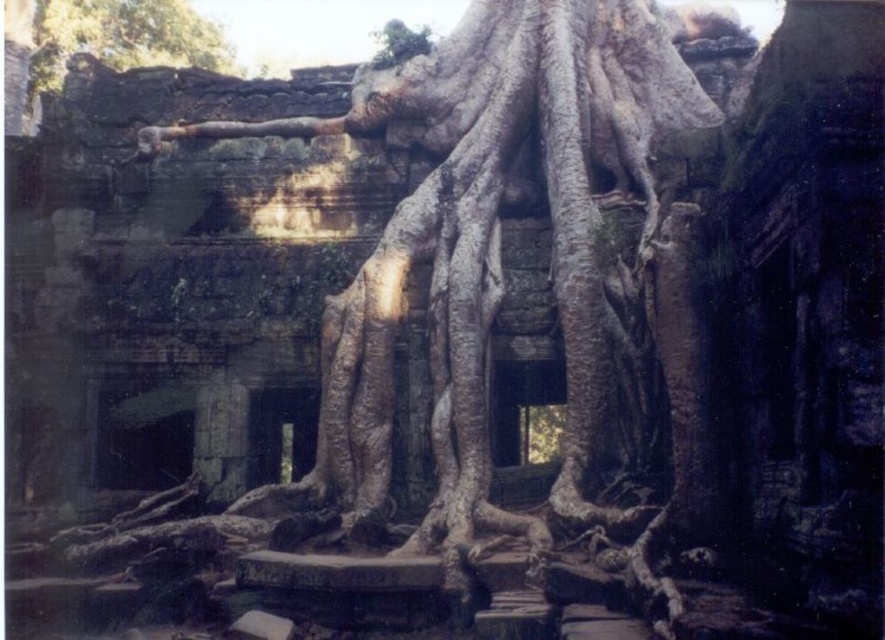
Is gray textured roots at center to the right of brown textured roots at upper left from the viewer's perspective?

Correct, you'll find gray textured roots at center to the right of brown textured roots at upper left.

Can you confirm if gray textured roots at center is bigger than brown textured roots at upper left?

Indeed, gray textured roots at center has a larger size compared to brown textured roots at upper left.

Is point (576, 99) closer to viewer compared to point (105, 33)?

Yes, it is.

The width and height of the screenshot is (885, 640). In order to click on gray textured roots at center in this screenshot , I will do `click(489, 241)`.